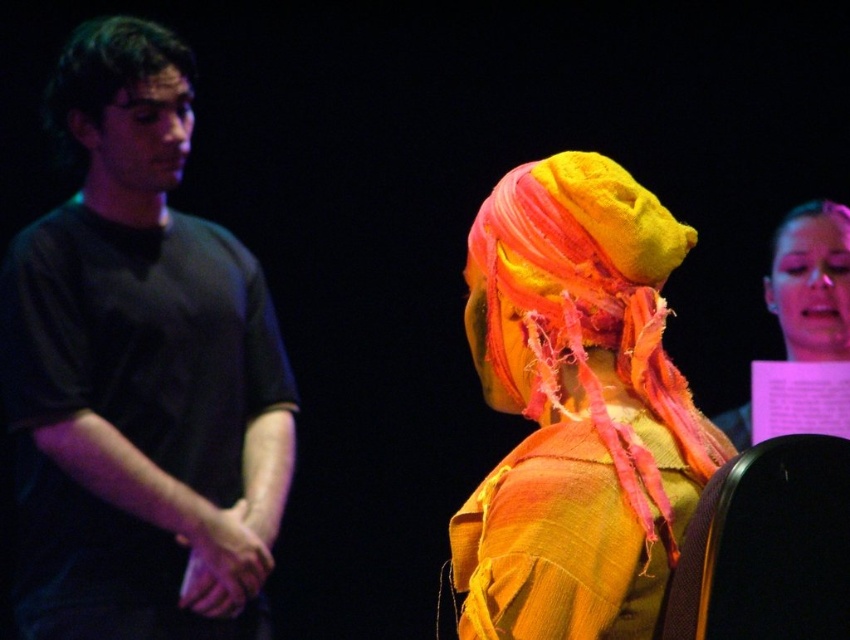
Question: Which point appears closest to the camera in this image?

Choices:
 (A) (820, 273)
 (B) (630, 428)
 (C) (248, 582)

Answer: (B)

Question: Among these points, which one is farthest from the camera?

Choices:
 (A) (140, 298)
 (B) (833, 273)
 (C) (658, 216)

Answer: (B)

Question: Is black matte shirt at left smaller than textured yellow-orange scarf at center?

Choices:
 (A) no
 (B) yes

Answer: (A)

Question: Is black matte shirt at left wider than matte yellow fabric headscarf at upper right?

Choices:
 (A) no
 (B) yes

Answer: (B)

Question: Which of the following is the farthest from the observer?

Choices:
 (A) (799, 348)
 (B) (690, 497)
 (C) (78, 520)

Answer: (A)

Question: Is textured yellow-orange scarf at center to the right of matte yellow fabric headscarf at upper right from the viewer's perspective?

Choices:
 (A) no
 (B) yes

Answer: (A)